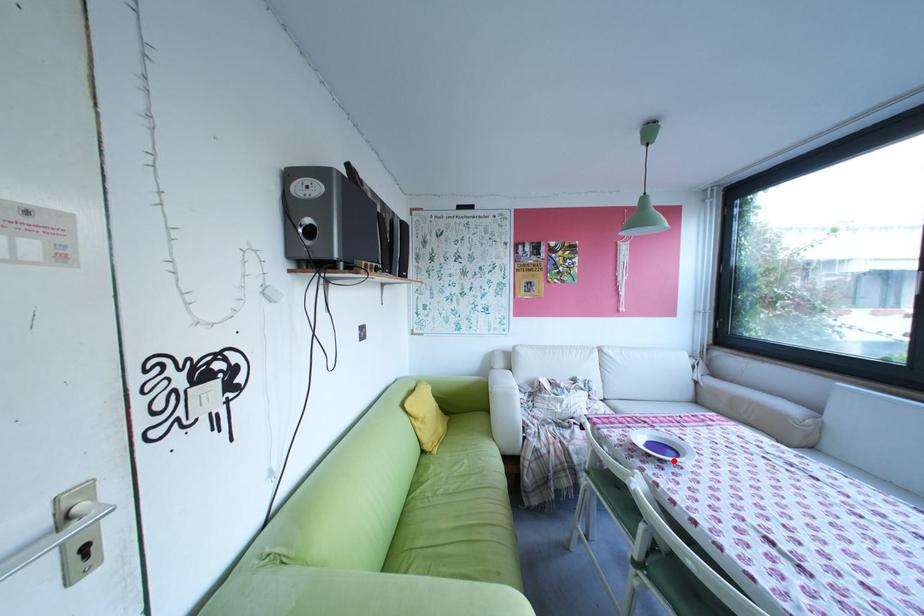
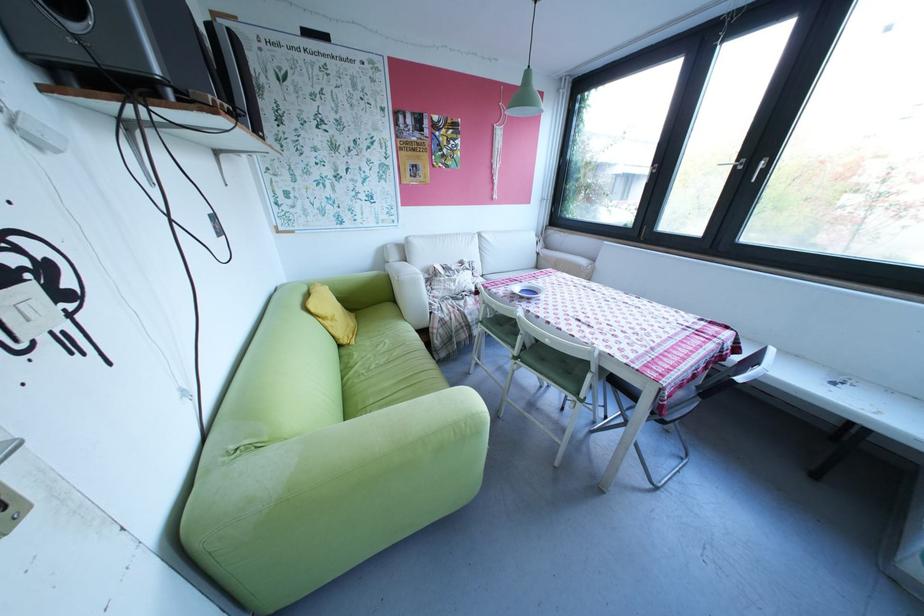
The point at the highlighted location is marked in the first image. Where is the corresponding point in the second image?

(541, 299)